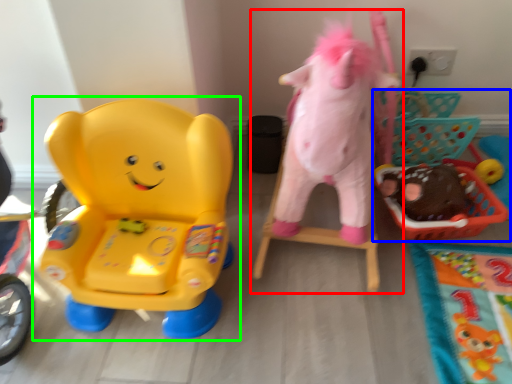
Question: Which object is positioned farthest from toy (highlighted by a red box)? Select from toy (highlighted by a blue box) and toy (highlighted by a green box).

Choices:
 (A) toy
 (B) toy

Answer: (B)